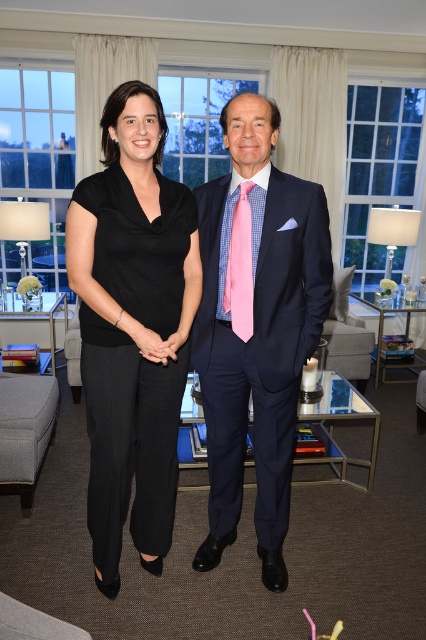
Question: Which point is farther to the camera?

Choices:
 (A) (175, 368)
 (B) (305, 292)
 (C) (34, 438)
 (D) (245, 224)

Answer: (C)

Question: Which object is the farthest from the matte black hands at center?

Choices:
 (A) pink checkered tie at center
 (B) black smooth dress at center

Answer: (A)

Question: Can you confirm if black smooth dress at center is positioned below matte black hands at center?

Choices:
 (A) yes
 (B) no

Answer: (A)

Question: Is gray fabric ottoman at lower left thinner than matte black hands at center?

Choices:
 (A) yes
 (B) no

Answer: (B)

Question: Which object appears farthest from the camera in this image?

Choices:
 (A) gray fabric ottoman at lower left
 (B) pink checkered tie at center
 (C) matte black dress at center
 (D) black smooth dress at center

Answer: (A)

Question: Is matte black dress at center smaller than black smooth dress at center?

Choices:
 (A) yes
 (B) no

Answer: (B)